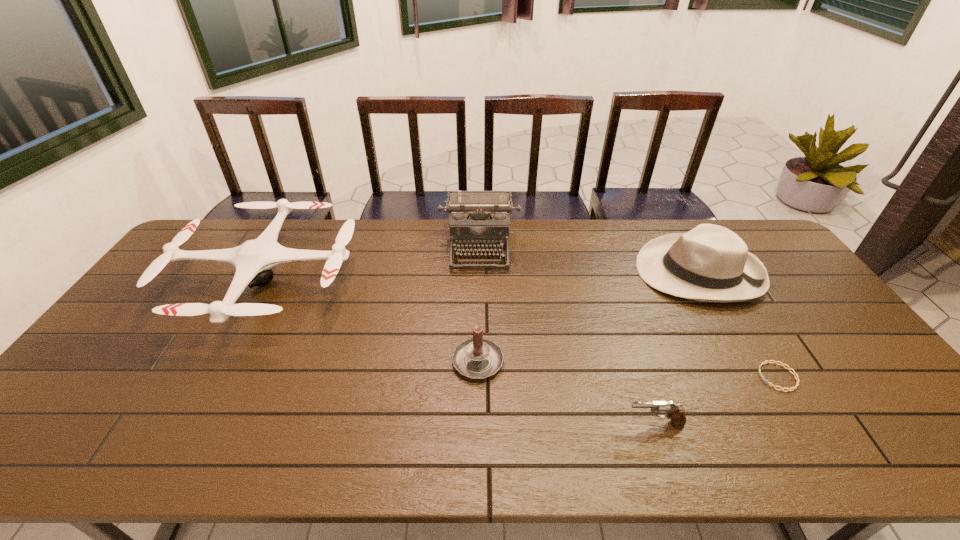
Where is `vacant space that is in between the typewriter and the shortest object`? Image resolution: width=960 pixels, height=540 pixels. vacant space that is in between the typewriter and the shortest object is located at coordinates (629, 312).

The width and height of the screenshot is (960, 540). I want to click on empty space between the pistol and the typewriter, so click(567, 336).

Find the location of `blank region between the typewriter and the leftmost object`. blank region between the typewriter and the leftmost object is located at coordinates (373, 265).

I want to click on vacant space in between the drone and the fedora, so click(483, 276).

Find the location of a particular element. The width and height of the screenshot is (960, 540). object that ranks as the fourth closest to the leftmost object is located at coordinates (710, 263).

This screenshot has height=540, width=960. I want to click on object that is the third closest one to the drone, so click(676, 413).